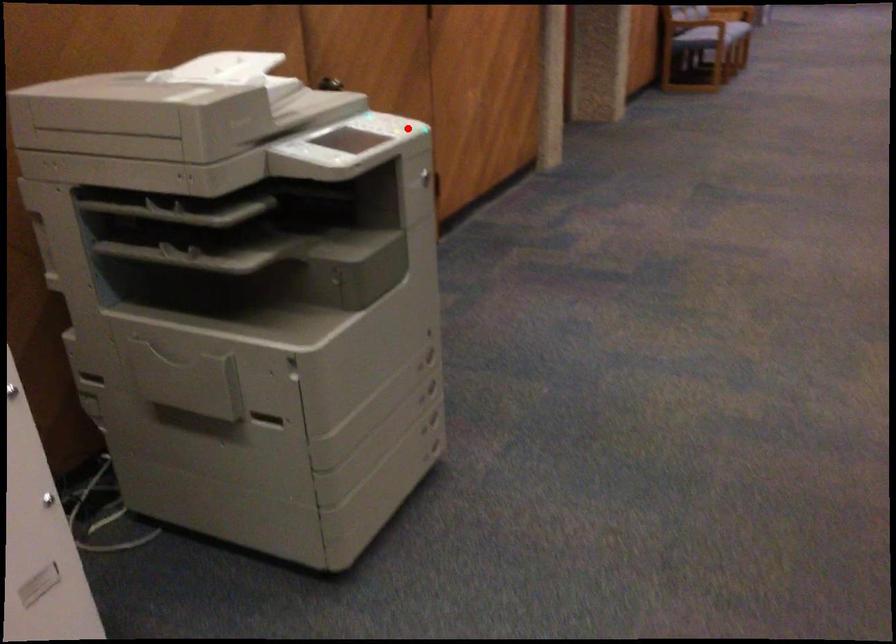
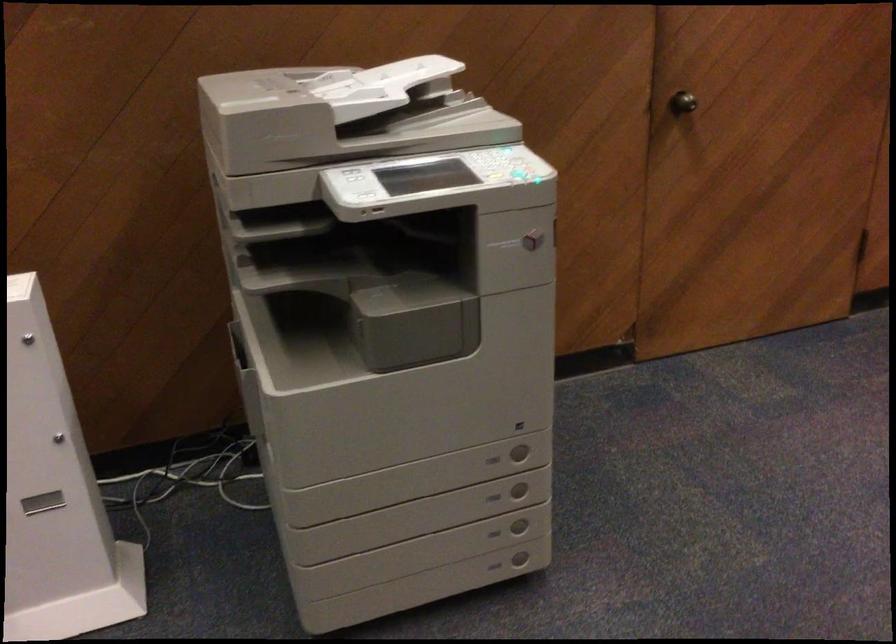
Question: I am providing you with two images of the same scene from different viewpoints. Given a red point in image1, look at the same physical point in image2. Is it:

Choices:
 (A) Closer to the viewpoint
 (B) Farther from the viewpoint

Answer: (A)